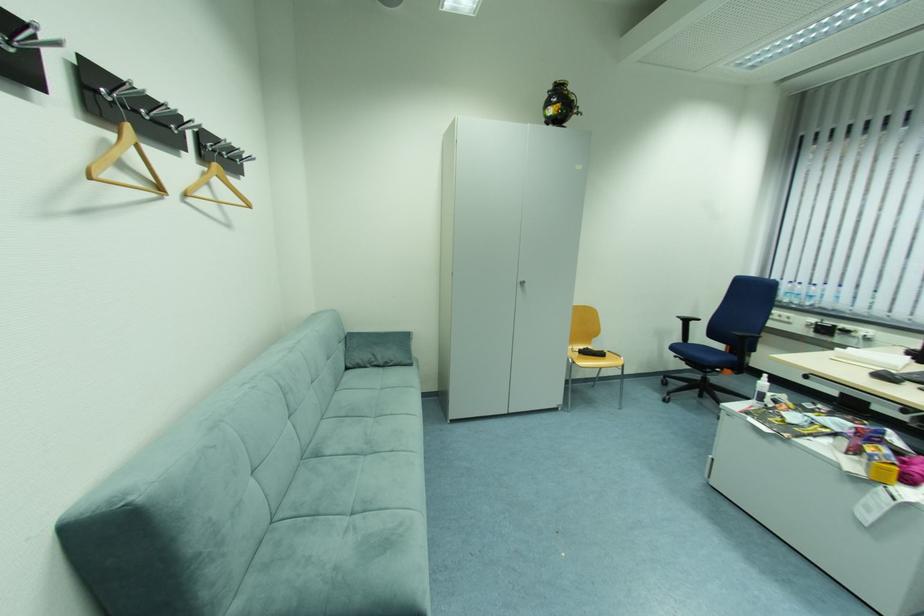
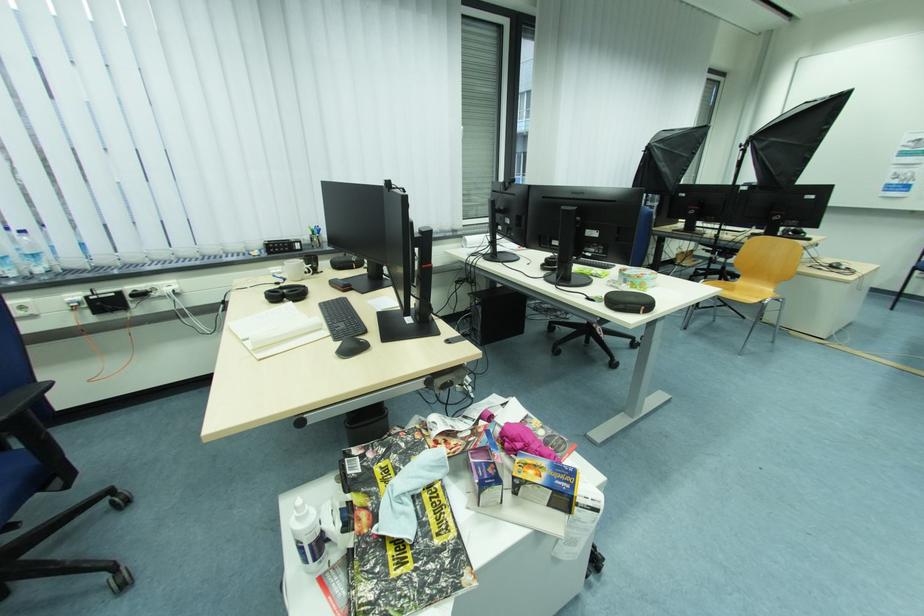
Find the pixel in the second image that matches pixel 818 297 in the first image.

(43, 257)